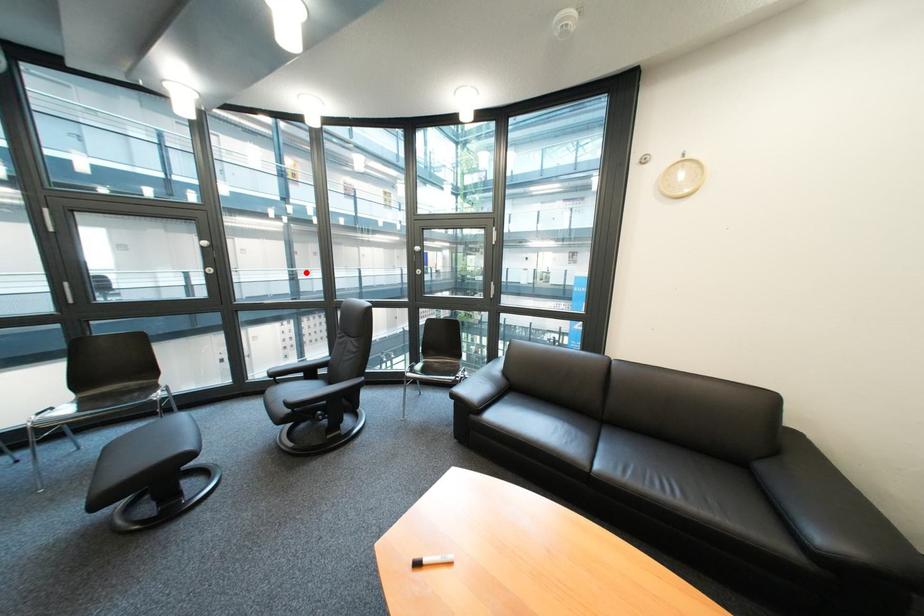
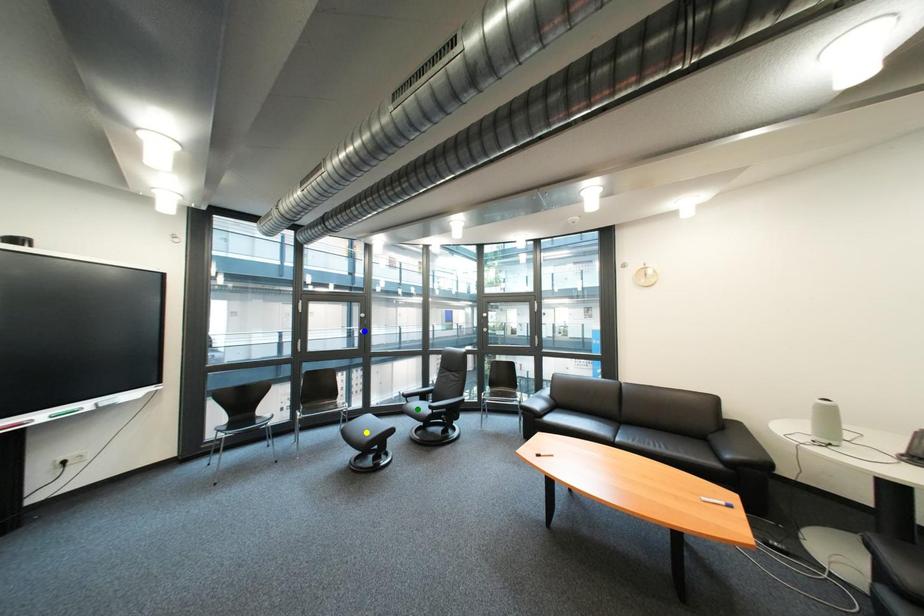
Question: I am providing you with two images of the same scene from different viewpoints. A red point is marked on the first image. You are given multiple points on the second image. Can you choose the point in image 2 that corresponds to the point in image 1?

Choices:
 (A) yellow point
 (B) blue point
 (C) green point

Answer: (B)